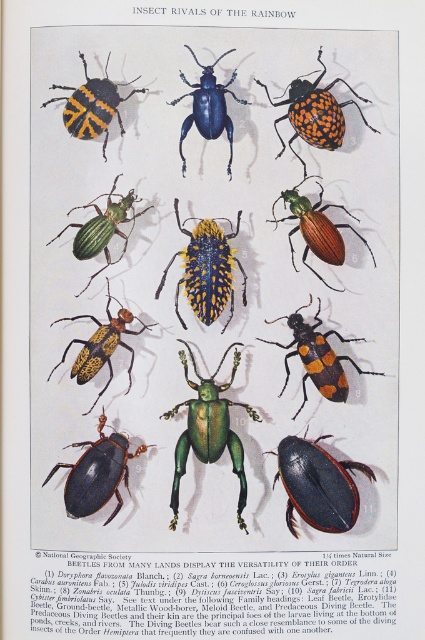
Who is positioned more to the right, orange-yellow spotted beetle at center-right or metallic green and orange beetle at center?

metallic green and orange beetle at center

Does orange-yellow spotted beetle at center-right appear over metallic green and orange beetle at center?

Actually, orange-yellow spotted beetle at center-right is below metallic green and orange beetle at center.

Which is in front, point (311, 355) or point (282, 192)?

Point (311, 355) is in front.

At what (x,y) coordinates should I click in order to perform the action: click on orange-yellow spotted beetle at center-right. Please return your answer as a coordinate pair (x, y). The image size is (425, 640). Looking at the image, I should click on (317, 356).

Between point (363, 465) and point (221, 412), which one is positioned in front?

Point (363, 465) is more forward.

Can you confirm if shiny black beetle at center is positioned below green glossy beetle at center?

Yes, shiny black beetle at center is below green glossy beetle at center.

Image resolution: width=425 pixels, height=640 pixels. What do you see at coordinates (317, 484) in the screenshot?
I see `shiny black beetle at center` at bounding box center [317, 484].

Where is `shiny black beetle at center`? This screenshot has width=425, height=640. shiny black beetle at center is located at coordinates (317, 484).

Between shiny black beetle at lower left and orange-yellow striped beetle at upper left, which one is positioned lower?

shiny black beetle at lower left

Between point (108, 451) and point (104, 90), which one is positioned behind?

The point (108, 451) is behind.

At what (x,y) coordinates should I click in order to perform the action: click on shiny black beetle at lower left. Please return your answer as a coordinate pair (x, y). Looking at the image, I should click on (96, 474).